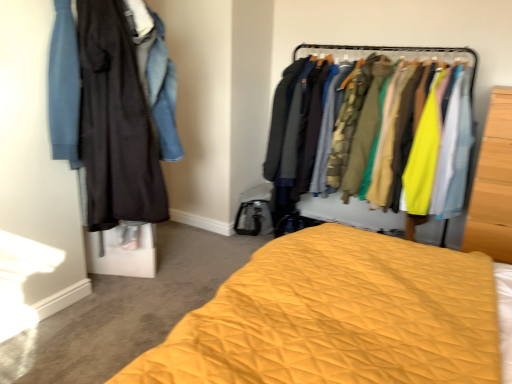
Question: Choose the correct answer: Is wooden wardrobe at right inside yellow quilted bed at center or outside it?

Choices:
 (A) outside
 (B) inside

Answer: (A)

Question: From a real-world perspective, is wooden wardrobe at right physically located above or below yellow quilted bed at center?

Choices:
 (A) below
 (B) above

Answer: (B)

Question: Which object is the farthest from the matte black coat at left, placed as the second clothing when sorted from top to bottom?

Choices:
 (A) textured fabric clothes at center
 (B) denim jacket at left, which is counted as the first clothing, starting from the top
 (C) wooden wardrobe at right
 (D) yellow quilted bed at center

Answer: (C)

Question: Based on their relative distances, which object is nearer to the denim jacket at left, the 2th clothing ordered from the bottom?

Choices:
 (A) yellow quilted bed at center
 (B) matte black coat at left, which appears as the 1th clothing when ordered from the bottom
 (C) textured fabric clothes at center
 (D) wooden wardrobe at right

Answer: (B)